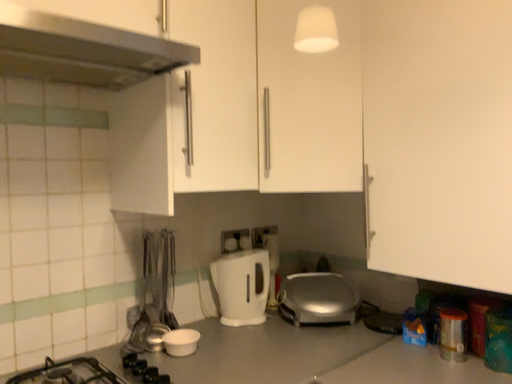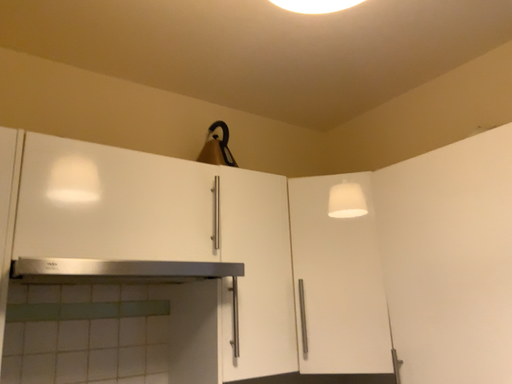
Question: How did the camera likely rotate when shooting the video?

Choices:
 (A) rotated downward
 (B) rotated upward

Answer: (B)